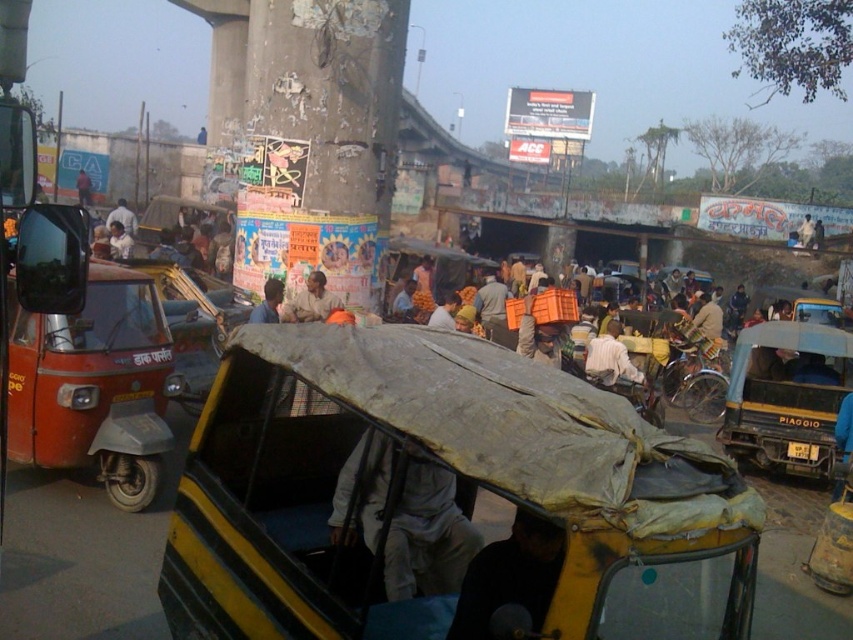
Based on the photo, you are a street vendor in the urban scene. You have an orange fabric cloth at center and a light brown fabric hat at upper center. Which item is narrower in width?

The orange fabric cloth at center has a lesser width compared to the light brown fabric hat at upper center, so the orange fabric cloth at center is narrower.